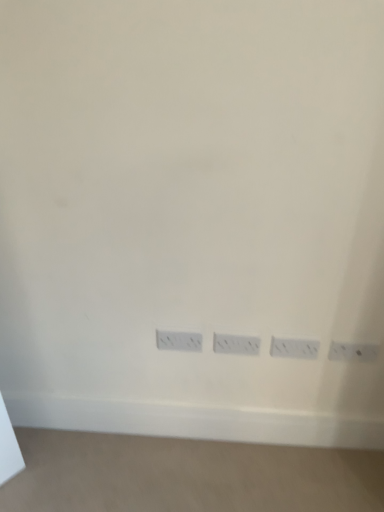
Question: From a real-world perspective, is white plastic power plugs and sockets at center, which is the second power plugs and sockets from right to left, on white plastic power plugs and sockets at lower right, the 1th power plugs and sockets from the right?

Choices:
 (A) no
 (B) yes

Answer: (A)

Question: Is white plastic power plugs and sockets at center, which is the second power plugs and sockets from right to left, at the left side of white plastic power plugs and sockets at lower right, placed as the 4th power plugs and sockets when sorted from left to right?

Choices:
 (A) no
 (B) yes

Answer: (B)

Question: Is white plastic power plugs and sockets at center, which is the second power plugs and sockets from right to left, closer to camera compared to white plastic power plugs and sockets at lower right, the 1th power plugs and sockets from the right?

Choices:
 (A) no
 (B) yes

Answer: (A)

Question: Can you confirm if white plastic power plugs and sockets at center, which is the second power plugs and sockets from right to left, is smaller than white plastic power plugs and sockets at lower right, the 1th power plugs and sockets from the right?

Choices:
 (A) yes
 (B) no

Answer: (B)

Question: Is white plastic power plugs and sockets at center, positioned as the 3th power plugs and sockets in left-to-right order, facing towards white plastic power plugs and sockets at lower right, placed as the 4th power plugs and sockets when sorted from left to right?

Choices:
 (A) yes
 (B) no

Answer: (B)

Question: In the image, is white plastic power plugs and sockets at lower right, the 1th power plugs and sockets from the right, positioned in front of or behind white plastic power plugs and sockets at lower center, which appears as the first power plugs and sockets when viewed from the left?

Choices:
 (A) front
 (B) behind

Answer: (A)

Question: Looking at the image, does white plastic power plugs and sockets at lower right, the 1th power plugs and sockets from the right, seem bigger or smaller compared to white plastic power plugs and sockets at lower center, which appears as the first power plugs and sockets when viewed from the left?

Choices:
 (A) small
 (B) big

Answer: (A)

Question: From a real-world perspective, relative to white plastic power plugs and sockets at lower center, which appears as the first power plugs and sockets when viewed from the left, is white plastic power plugs and sockets at lower right, the 1th power plugs and sockets from the right, vertically above or below?

Choices:
 (A) above
 (B) below

Answer: (A)

Question: Based on their positions, is white plastic power plugs and sockets at lower right, the 1th power plugs and sockets from the right, located to the left or right of white plastic power plugs and sockets at lower center, which is counted as the 4th power plugs and sockets, starting from the right?

Choices:
 (A) right
 (B) left

Answer: (A)

Question: Is white plastic power plugs and sockets at center, the second power plugs and sockets when ordered from left to right, in front of or behind white plastic power plugs and sockets at lower center, which is counted as the 4th power plugs and sockets, starting from the right, in the image?

Choices:
 (A) behind
 (B) front

Answer: (B)

Question: Is white plastic power plugs and sockets at center, positioned as the third power plugs and sockets in right-to-left order, wider or thinner than white plastic power plugs and sockets at lower center, which is counted as the 4th power plugs and sockets, starting from the right?

Choices:
 (A) thin
 (B) wide

Answer: (A)

Question: From the image's perspective, is white plastic power plugs and sockets at center, the second power plugs and sockets when ordered from left to right, located above or below white plastic power plugs and sockets at lower center, which is counted as the 4th power plugs and sockets, starting from the right?

Choices:
 (A) above
 (B) below

Answer: (B)

Question: In terms of height, does white plastic power plugs and sockets at center, the second power plugs and sockets when ordered from left to right, look taller or shorter compared to white plastic power plugs and sockets at lower center, which is counted as the 4th power plugs and sockets, starting from the right?

Choices:
 (A) tall
 (B) short

Answer: (A)

Question: In terms of height, does white plastic power plugs and sockets at lower center, which appears as the first power plugs and sockets when viewed from the left, look taller or shorter compared to white plastic power plugs and sockets at lower right, the 1th power plugs and sockets from the right?

Choices:
 (A) short
 (B) tall

Answer: (B)

Question: Looking at their shapes, would you say white plastic power plugs and sockets at lower center, which is counted as the 4th power plugs and sockets, starting from the right, is wider or thinner than white plastic power plugs and sockets at lower right, placed as the 4th power plugs and sockets when sorted from left to right?

Choices:
 (A) thin
 (B) wide

Answer: (B)